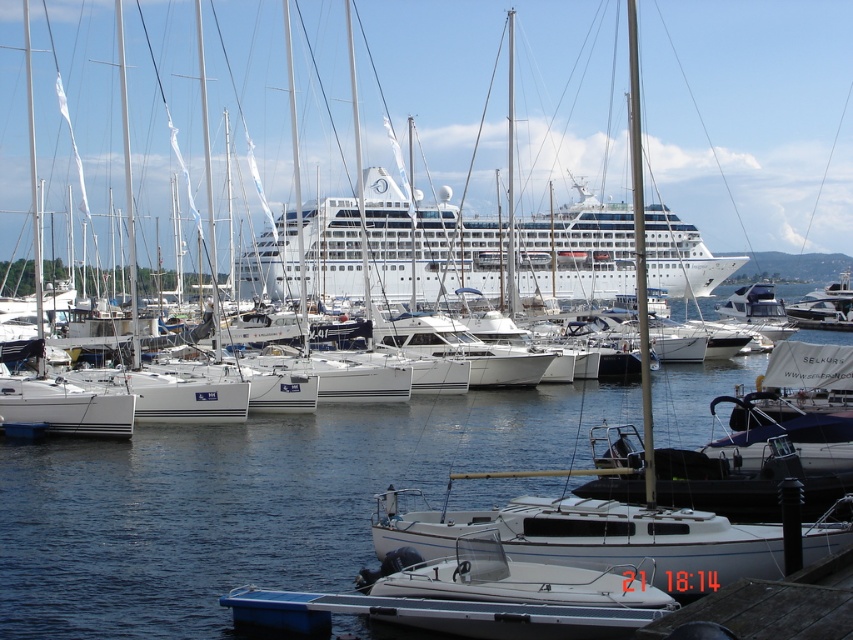
Does blue water at center appear on the left side of wooden dock at lower right?

Incorrect, blue water at center is not on the left side of wooden dock at lower right.

Does blue water at center come in front of wooden dock at lower right?

No, it is not.

The width and height of the screenshot is (853, 640). I want to click on blue water at center, so click(x=248, y=500).

Which is in front, point (112, 536) or point (486, 609)?

Point (486, 609)

Locate an element on the screen. blue water at center is located at coordinates (248, 500).

Identify the location of blue water at center. 248,500.

Does blue water at center appear on the right side of white glossy cruise ship at center?

Indeed, blue water at center is positioned on the right side of white glossy cruise ship at center.

Is blue water at center thinner than white glossy cruise ship at center?

Indeed, blue water at center has a lesser width compared to white glossy cruise ship at center.

You are a GUI agent. You are given a task and a screenshot of the screen. Output one action in this format:
    pyautogui.click(x=<x>, y=<y>)
    Task: Click on the blue water at center
    This screenshot has height=640, width=853.
    Given the screenshot: What is the action you would take?
    pyautogui.click(x=248, y=500)

At what (x,y) coordinates should I click in order to perform the action: click on blue water at center. Please return your answer as a coordinate pair (x, y). Image resolution: width=853 pixels, height=640 pixels. Looking at the image, I should click on (248, 500).